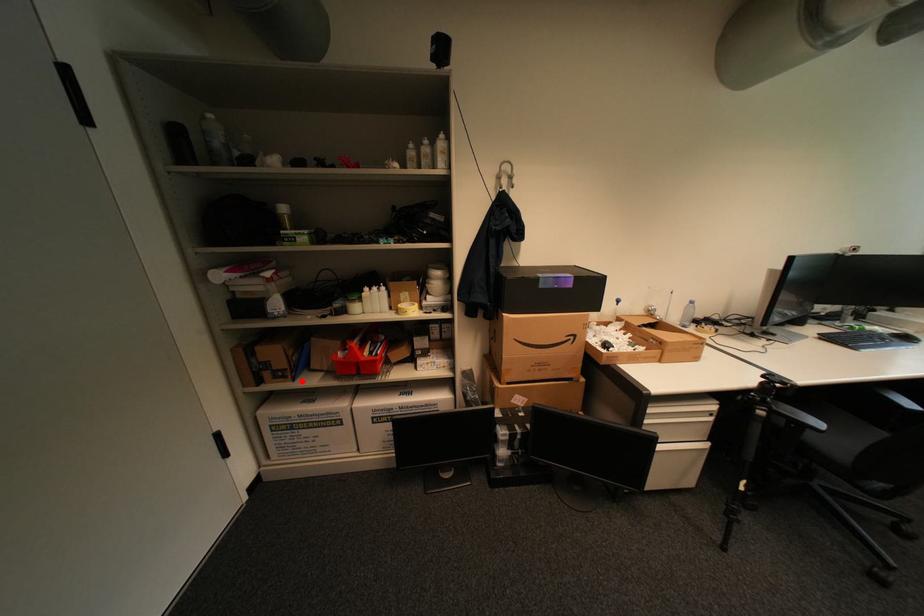
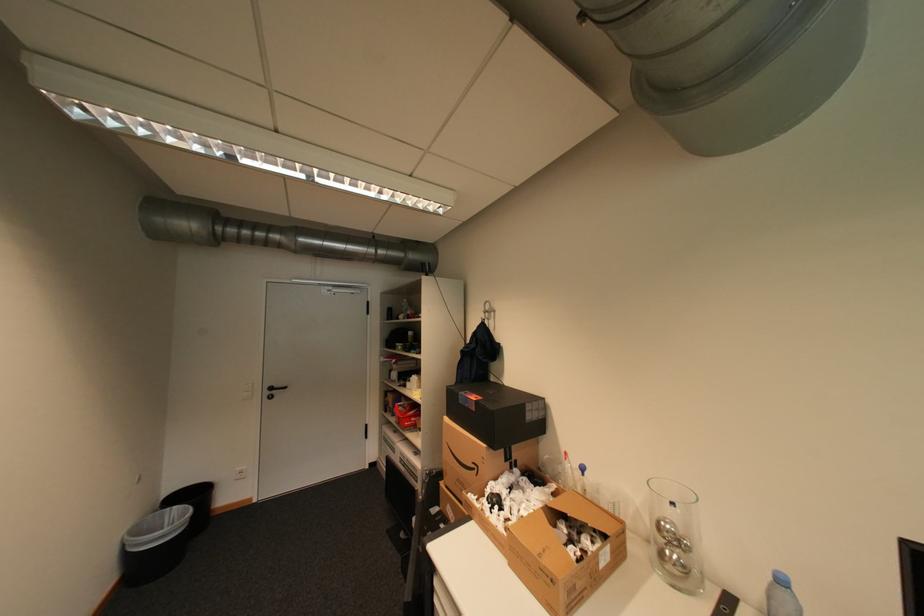
Locate, in the second image, the point that corresponds to the highlighted location in the first image.

(400, 416)